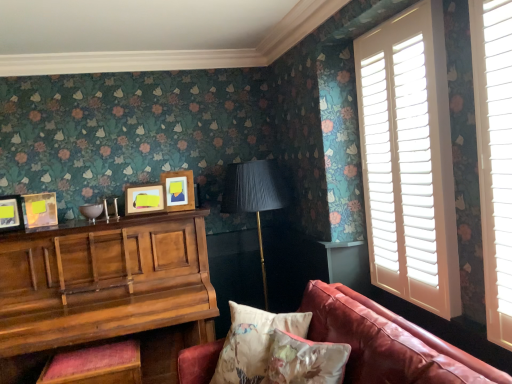
Question: Is wooden piano at left wider or thinner than floral fabric cushion at lower center?

Choices:
 (A) wide
 (B) thin

Answer: (A)

Question: Considering the positions of wooden piano at left and floral fabric cushion at lower center in the image, is wooden piano at left taller or shorter than floral fabric cushion at lower center?

Choices:
 (A) tall
 (B) short

Answer: (A)

Question: Which of these objects is positioned closest to the matte wooden picture frame at center, which appears as the first picture frame when viewed from the right?

Choices:
 (A) matte yellow picture frame at left, the 2th picture frame when ordered from left to right
 (B) wooden piano at left
 (C) leather couch at lower right
 (D) matte wooden picture frame at upper center, positioned as the 3th picture frame in left-to-right order
 (E) velvet red music stool at lower left

Answer: (D)

Question: Which of these objects is positioned closest to the matte wooden picture frame at center, positioned as the 4th picture frame in left-to-right order?

Choices:
 (A) floral fabric cushion at lower center
 (B) velvet red music stool at lower left
 (C) wooden piano at left
 (D) black pleated fabric at center
 (E) matte wooden picture frame at left, which is the first picture frame from left to right

Answer: (D)